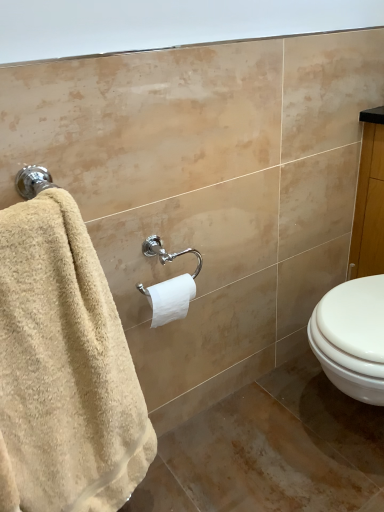
Question: Is the depth of white matte toilet paper at center less than that of beige terry cloth towel at left?

Choices:
 (A) yes
 (B) no

Answer: (B)

Question: From the image's perspective, would you say white matte toilet paper at center is shown under beige terry cloth towel at left?

Choices:
 (A) yes
 (B) no

Answer: (B)

Question: Is white matte toilet paper at center far away from beige terry cloth towel at left?

Choices:
 (A) no
 (B) yes

Answer: (A)

Question: Does white matte toilet paper at center have a greater width compared to beige terry cloth towel at left?

Choices:
 (A) yes
 (B) no

Answer: (B)

Question: Is beige terry cloth towel at left a part of white matte toilet paper at center?

Choices:
 (A) no
 (B) yes

Answer: (A)

Question: Is white matte toilet paper at center at the left side of beige terry cloth towel at left?

Choices:
 (A) no
 (B) yes

Answer: (A)

Question: Does beige terry cloth towel at left have a larger size compared to white matte toilet paper at center?

Choices:
 (A) no
 (B) yes

Answer: (B)

Question: From the image's perspective, is beige terry cloth towel at left under white matte toilet paper at center?

Choices:
 (A) no
 (B) yes

Answer: (B)

Question: Can you confirm if beige terry cloth towel at left is positioned to the right of white matte toilet paper at center?

Choices:
 (A) no
 (B) yes

Answer: (A)

Question: Is beige terry cloth towel at left taller than white matte toilet paper at center?

Choices:
 (A) no
 (B) yes

Answer: (B)

Question: Is white matte toilet paper at center surrounded by beige terry cloth towel at left?

Choices:
 (A) yes
 (B) no

Answer: (B)

Question: Are beige terry cloth towel at left and white matte toilet paper at center located far from each other?

Choices:
 (A) yes
 (B) no

Answer: (B)

Question: In terms of height, does beige terry cloth towel at left look taller or shorter compared to white matte toilet paper at center?

Choices:
 (A) tall
 (B) short

Answer: (A)